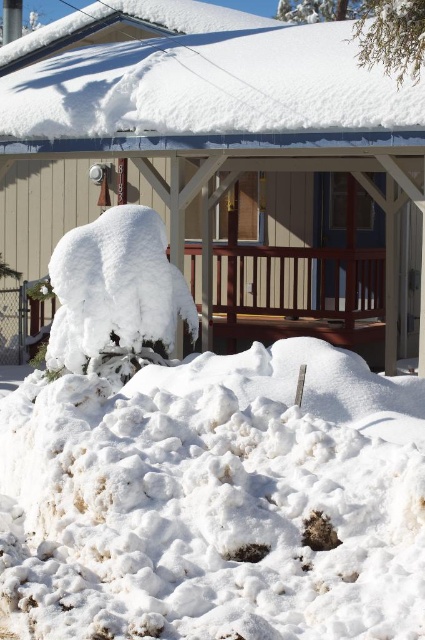
Which is below, white fluffy snow at lower center or white fluffy snow at center?

white fluffy snow at lower center is below.

Which is in front, point (359, 538) or point (212, 99)?

Positioned in front is point (359, 538).

Find the location of a particular element. The image size is (425, 640). white fluffy snow at lower center is located at coordinates (215, 500).